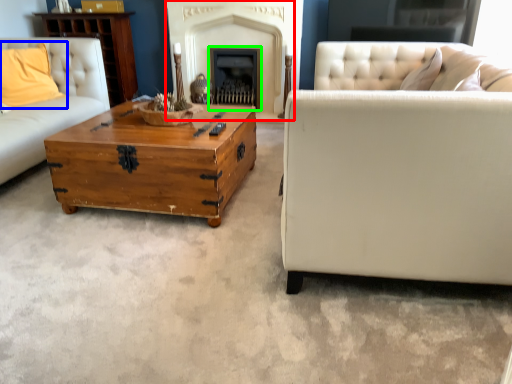
Question: Considering the real-world distances, which object is closest to fireplace (highlighted by a red box)? pillow (highlighted by a blue box) or fireplace (highlighted by a green box).

Choices:
 (A) pillow
 (B) fireplace

Answer: (B)